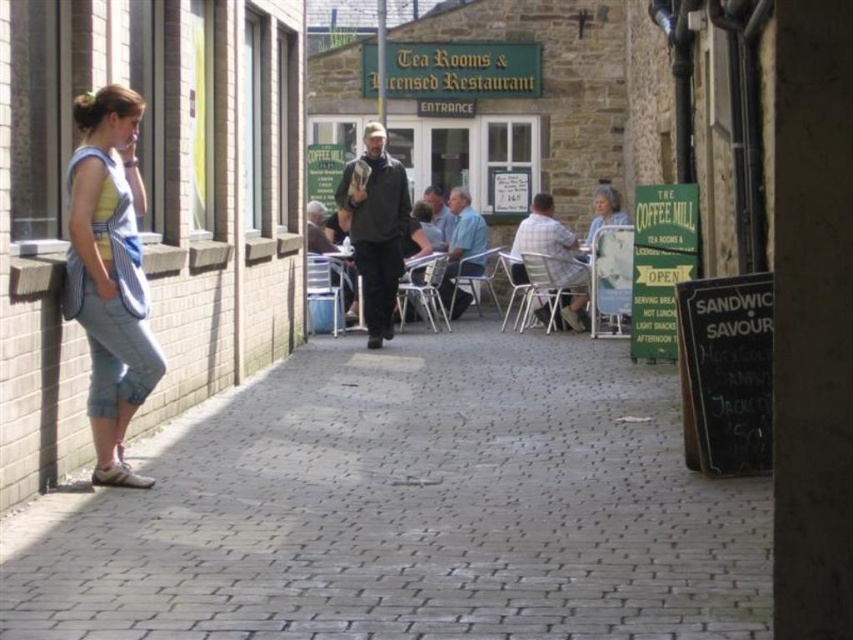
Please describe the position of the gray brick pavement at center in terms of coordinates within the image. The image has a coordinate system where the bottom left corner is the origin point. The x and y axes increase to the right and upwards respectively. The coordinates are normalized between 0 and 1. Please provide the coordinates as a pair of numbers separated by a comma, enclosed in parentheses.

The gray brick pavement at center is located at coordinates point (407,508).

You are a delivery person who needs to place a package at the point marked as point [407,508]. According to the scene, where exactly should you place the package?

The package should be placed on the gray brick pavement at center, as the point [407,508] is located there.

You are standing at the point labeled point (103, 499) and want to walk towards the point labeled point (426, 276). Which direction should you move in relation to the camera?

Since point (103, 499) is closer to the camera than point (426, 276), you should move away from the camera to reach point (426, 276).